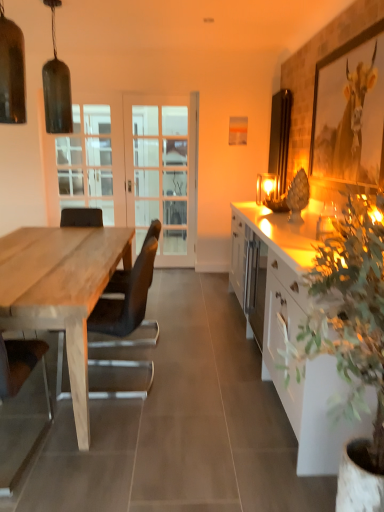
Question: Can you confirm if matte glass lamp at upper right, the first lamp in the back-to-front sequence, is taller than white glass screen door at center, arranged as the first screen door when viewed from the right?

Choices:
 (A) yes
 (B) no

Answer: (B)

Question: From a real-world perspective, is matte glass lamp at upper right, the 3th lamp from the left, over white glass screen door at center, which is the second screen door in left-to-right order?

Choices:
 (A) yes
 (B) no

Answer: (A)

Question: Is matte glass lamp at upper right, which is counted as the third lamp, starting from the front, bigger than white glass screen door at center, arranged as the first screen door when viewed from the right?

Choices:
 (A) no
 (B) yes

Answer: (A)

Question: Is matte glass lamp at upper right, the 3th lamp from the left, to the left of white glass screen door at center, which is the second screen door in left-to-right order, from the viewer's perspective?

Choices:
 (A) yes
 (B) no

Answer: (B)

Question: Is matte glass lamp at upper right, the 3th lamp from the left, completely or partially outside of white glass screen door at center, which is the second screen door in left-to-right order?

Choices:
 (A) no
 (B) yes

Answer: (B)

Question: Which is correct: white glossy cabinet at right is inside matte wooden picture frame at upper center, the first picture frame viewed from the back, or outside of it?

Choices:
 (A) outside
 (B) inside

Answer: (A)

Question: Is white glossy cabinet at right to the left or to the right of matte wooden picture frame at upper center, the first picture frame viewed from the back, in the image?

Choices:
 (A) left
 (B) right

Answer: (B)

Question: From a real-world perspective, is white glossy cabinet at right above or below matte wooden picture frame at upper center, positioned as the 2th picture frame in right-to-left order?

Choices:
 (A) above
 (B) below

Answer: (B)

Question: In terms of size, does white glossy cabinet at right appear bigger or smaller than matte wooden picture frame at upper center, which appears as the 2th picture frame when viewed from the front?

Choices:
 (A) big
 (B) small

Answer: (A)

Question: Considering their positions, is black leather chair at left, marked as the 1th chair in a right-to-left arrangement, located in front of or behind matte wooden picture frame at upper center, positioned as the 2th picture frame in right-to-left order?

Choices:
 (A) front
 (B) behind

Answer: (A)

Question: Is black leather chair at left, which is the 2th chair in left-to-right order, taller or shorter than matte wooden picture frame at upper center, the first picture frame viewed from the back?

Choices:
 (A) tall
 (B) short

Answer: (A)

Question: From the image's perspective, is black leather chair at left, which is the 2th chair in left-to-right order, located above or below matte wooden picture frame at upper center, the first picture frame viewed from the back?

Choices:
 (A) above
 (B) below

Answer: (B)

Question: Based on their positions, is black leather chair at left, marked as the 1th chair in a right-to-left arrangement, located to the left or right of matte wooden picture frame at upper center, which appears as the 2th picture frame when viewed from the front?

Choices:
 (A) right
 (B) left

Answer: (B)

Question: Is matte glass pendant light at upper left, placed as the 2th lamp when sorted from back to front, inside or outside of metallic gold picture frame at upper right, positioned as the first picture frame in front-to-back order?

Choices:
 (A) outside
 (B) inside

Answer: (A)

Question: In terms of height, does matte glass pendant light at upper left, marked as the first lamp in a left-to-right arrangement, look taller or shorter compared to metallic gold picture frame at upper right, acting as the second picture frame starting from the left?

Choices:
 (A) short
 (B) tall

Answer: (A)